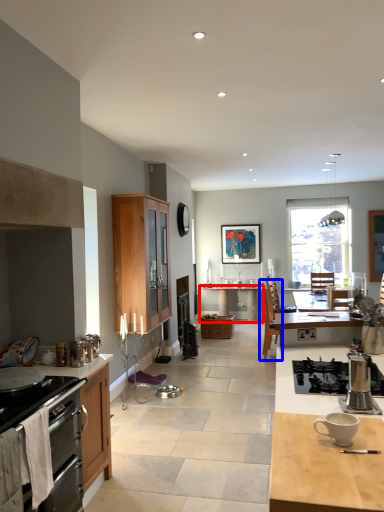
Question: Which object appears farthest to the camera in this image, desk (highlighted by a red box) or chair (highlighted by a blue box)?

Choices:
 (A) desk
 (B) chair

Answer: (A)